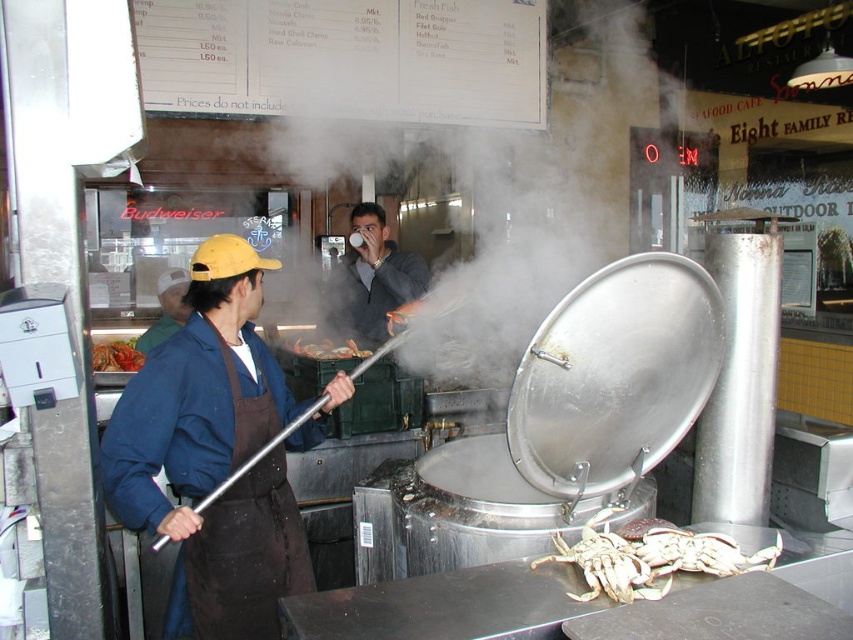
You are a customer at the seafood restaurant and want to take a photo of the menu board without the white vapor at center obstructing the view. Where should you position yourself relative to the steamer pot to ensure the vapor isn not between you and the menu board?

The white vapor at center is located at point (555, 182), so you should position yourself to the left or right of the steamer pot to avoid the vapor obstructing the view of the menu board.

You are a customer standing in the restaurant and want to grab the shiny silver crab at center from the steamer pot. However, there is a brown apron at left in the way. Can you safely reach the crab without getting too close to the steamer?

The distance between the brown apron at left and the shiny silver crab at center is 80.07 centimeters, so you can safely reach the crab without getting too close to the steamer.

You are a customer trying to read the menu board but are having trouble because of the steam. You notice the matte gray sweater at center and the brown apron at left. Which object is closer to your eyes?

The matte gray sweater at center is closer to your eyes because it is positioned above the brown apron at left, which is further away.